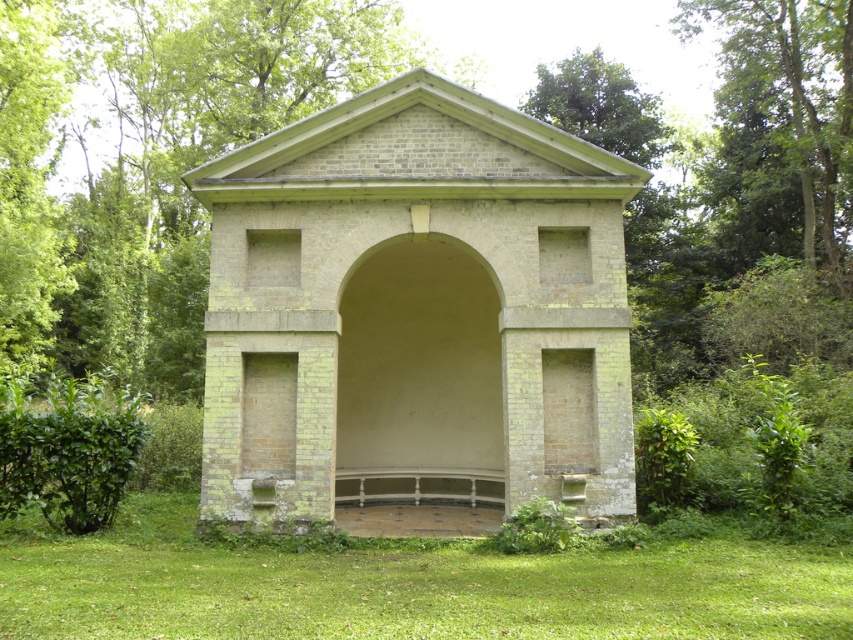
Question: In this image, where is yellow-green brick chapel at center located relative to green grass at lower center?

Choices:
 (A) left
 (B) right

Answer: (A)

Question: Which point is closer to the camera?

Choices:
 (A) green grass at lower center
 (B) yellow-green brick chapel at center

Answer: (A)

Question: Is yellow-green brick chapel at center wider than green grass at lower center?

Choices:
 (A) yes
 (B) no

Answer: (A)

Question: Does yellow-green brick chapel at center appear on the left side of green grass at lower center?

Choices:
 (A) yes
 (B) no

Answer: (A)

Question: Which point is farther to the camera?

Choices:
 (A) (19, 520)
 (B) (431, 301)

Answer: (B)

Question: Which point is farther from the camera taking this photo?

Choices:
 (A) (433, 298)
 (B) (67, 630)

Answer: (A)